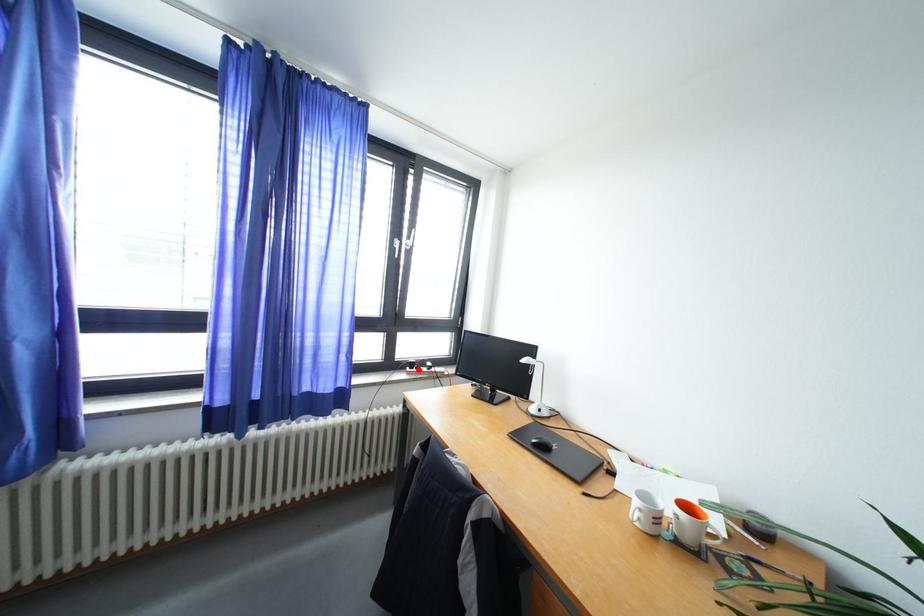
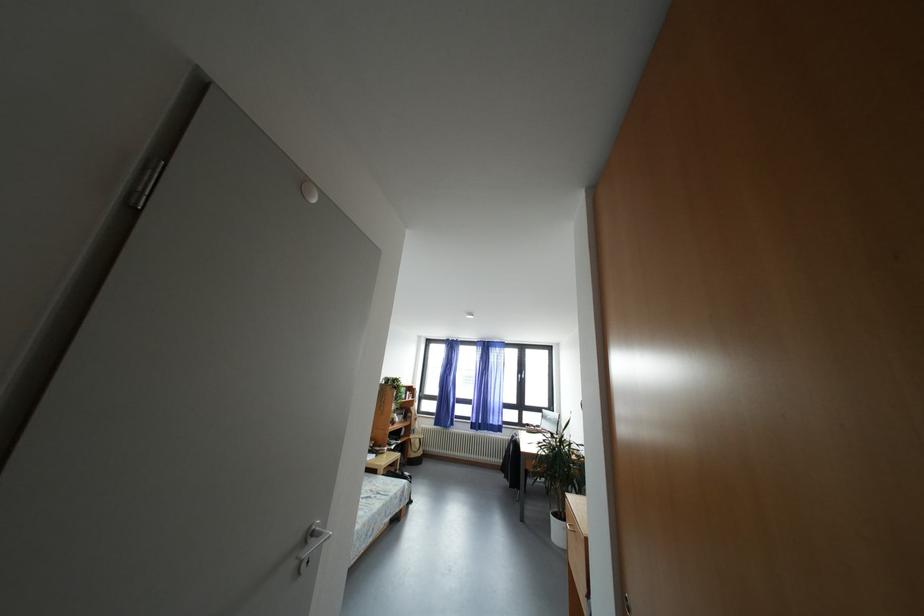
Locate, in the second image, the point that corresponds to the highlighted location in the first image.

(533, 430)